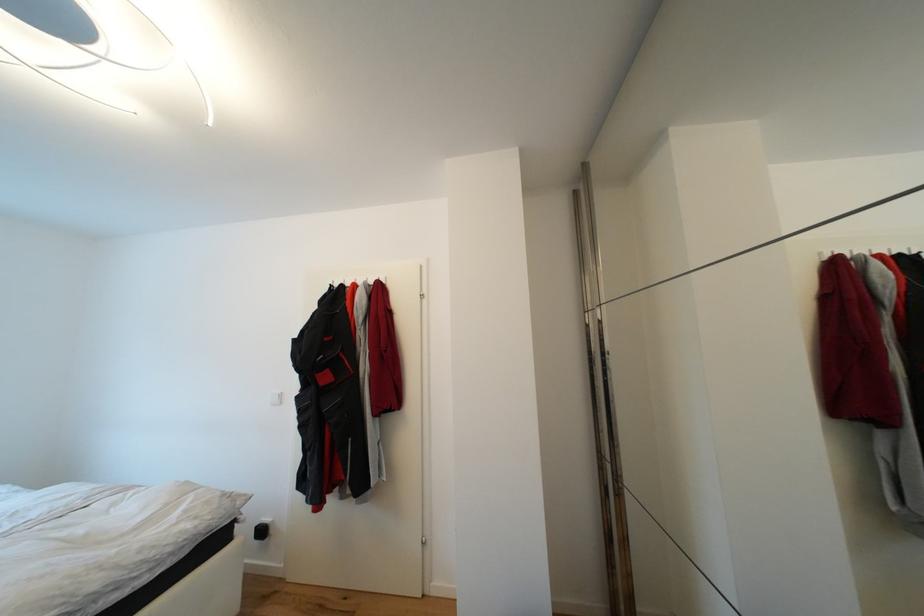
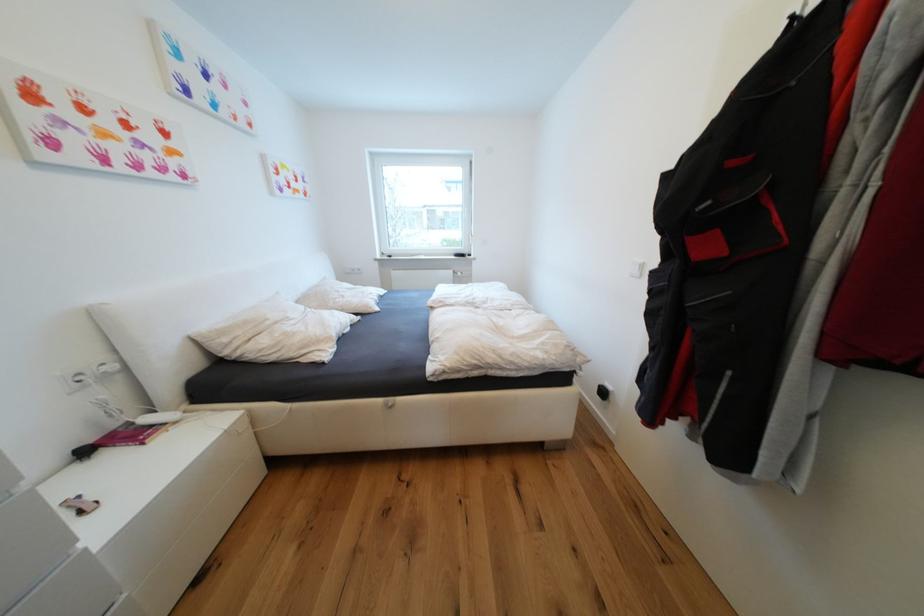
In the second image, find the point that corresponds to the point at 333,379 in the first image.

(714, 249)